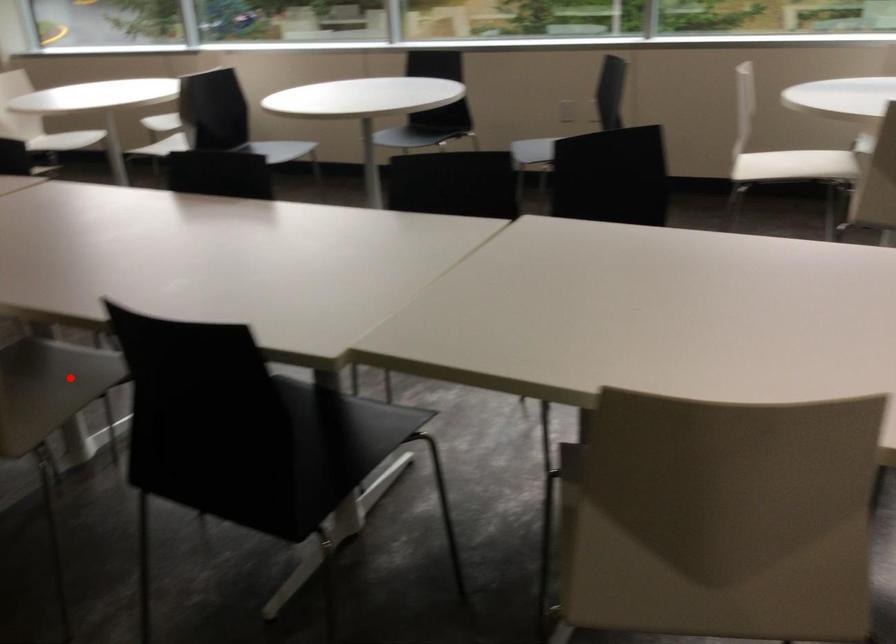
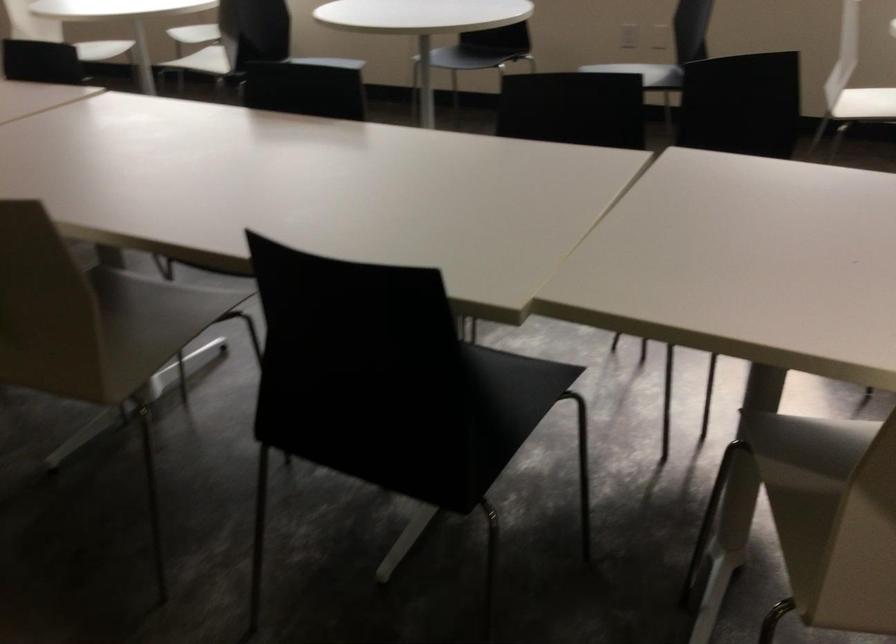
Locate, in the second image, the point that corresponds to the highlighted location in the first image.

(159, 317)